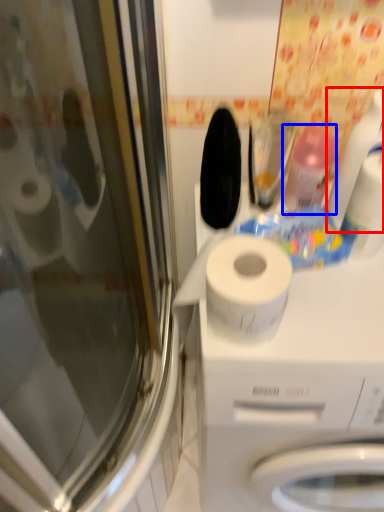
Question: Which object is further to the camera taking this photo, cleaning product (highlighted by a red box) or cleaning product (highlighted by a blue box)?

Choices:
 (A) cleaning product
 (B) cleaning product

Answer: (B)